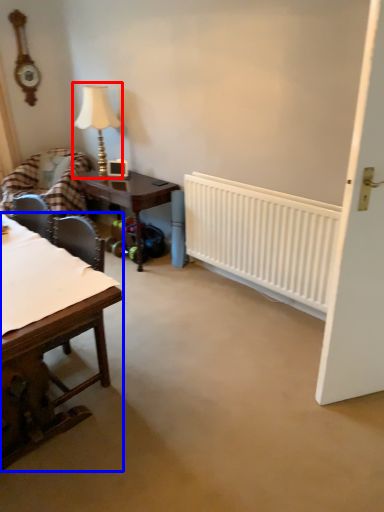
Question: Among these objects, which one is farthest to the camera, table lamp (highlighted by a red box) or table (highlighted by a blue box)?

Choices:
 (A) table lamp
 (B) table

Answer: (A)